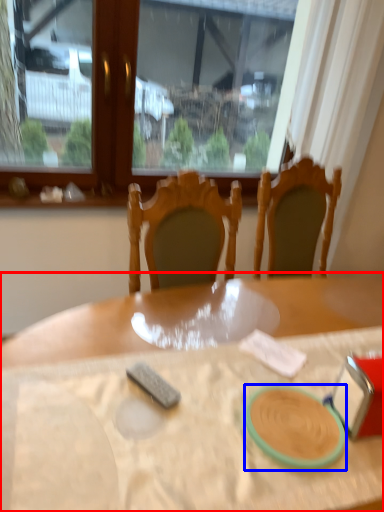
Question: Which object appears farthest to the camera in this image, table (highlighted by a red box) or tableware (highlighted by a blue box)?

Choices:
 (A) table
 (B) tableware

Answer: (B)